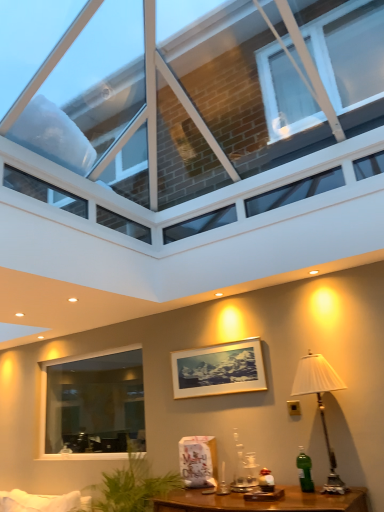
What is the approximate width of white fabric lampshade at right?

14.46 inches.

What do you see at coordinates (320, 404) in the screenshot?
I see `white fabric lampshade at right` at bounding box center [320, 404].

Locate an element on the screen. The width and height of the screenshot is (384, 512). clear glass window at lower left, the 2th window positioned from the top is located at coordinates (92, 405).

Identify the location of white fabric lampshade at right. (320, 404).

Is clear glass window at lower left, the 2th window positioned from the top, inside the boundaries of white fabric lampshade at right, or outside?

clear glass window at lower left, the 2th window positioned from the top, is spatially situated outside white fabric lampshade at right.

Is clear glass window at lower left, the 2th window positioned from the top, far away from white fabric lampshade at right?

clear glass window at lower left, the 2th window positioned from the top, is far away from white fabric lampshade at right.

From a real-world perspective, between clear glass window at lower left, the 2th window positioned from the top, and white fabric lampshade at right, who is vertically higher?

clear glass window at lower left, the 2th window positioned from the top.

Which is behind, clear glass window at lower left, marked as the 1th window in a back-to-front arrangement, or white fabric lampshade at right?

Positioned behind is clear glass window at lower left, marked as the 1th window in a back-to-front arrangement.

Looking at this image, can you confirm if clear glass window at lower left, marked as the 1th window in a back-to-front arrangement, is taller than gold-framed picture at center?

Correct, clear glass window at lower left, marked as the 1th window in a back-to-front arrangement, is much taller as gold-framed picture at center.

From the image's perspective, between clear glass window at lower left, the 2th window positioned from the top, and gold-framed picture at center, who is located below?

clear glass window at lower left, the 2th window positioned from the top, from the image's perspective.

Are clear glass window at lower left, positioned as the second window in front-to-back order, and gold-framed picture at center beside each other?

They are not placed beside each other.

Does point (116, 445) come farther from viewer compared to point (206, 364)?

Yes.

From a real-world perspective, who is located lower, gold-framed picture at center or clear glass window at lower left, the 2th window positioned from the top?

clear glass window at lower left, the 2th window positioned from the top, is physically lower.

Is gold-framed picture at center beside clear glass window at lower left, positioned as the second window in front-to-back order?

There is a gap between gold-framed picture at center and clear glass window at lower left, positioned as the second window in front-to-back order.

Is gold-framed picture at center facing away from clear glass window at lower left, the 2th window positioned from the top?

No, gold-framed picture at center is not facing the opposite direction of clear glass window at lower left, the 2th window positioned from the top.

From the image's perspective, does gold-framed picture at center appear lower than clear glass window at lower left, positioned as the second window in front-to-back order?

No, from the image's perspective, gold-framed picture at center is not beneath clear glass window at lower left, positioned as the second window in front-to-back order.

What's the angular difference between transparent glass roof at upper center, which is the 2th window in bottom-to-top order, and clear glass window at lower left, the 2th window positioned from the top,'s facing directions?

There is a 179-degree angle between the facing directions of transparent glass roof at upper center, which is the 2th window in bottom-to-top order, and clear glass window at lower left, the 2th window positioned from the top.

Based on their positions, is transparent glass roof at upper center, placed as the 2th window when sorted from back to front, located to the left or right of clear glass window at lower left, the 2th window positioned from the top?

Clearly, transparent glass roof at upper center, placed as the 2th window when sorted from back to front, is on the right of clear glass window at lower left, the 2th window positioned from the top, in the image.

Is transparent glass roof at upper center, the 1th window positioned from the front, beside clear glass window at lower left, positioned as the second window in front-to-back order?

There is a gap between transparent glass roof at upper center, the 1th window positioned from the front, and clear glass window at lower left, positioned as the second window in front-to-back order.

From the picture: Does transparent glass roof at upper center, placed as the 2th window when sorted from back to front, turn towards clear glass window at lower left, positioned as the second window in front-to-back order?

No, transparent glass roof at upper center, placed as the 2th window when sorted from back to front, is not aimed at clear glass window at lower left, positioned as the second window in front-to-back order.

Can you tell me how much white fabric lampshade at right and clear glass window at lower left, marked as the 1th window in a back-to-front arrangement, differ in facing direction?

There is a 0.000488-degree angle between the facing directions of white fabric lampshade at right and clear glass window at lower left, marked as the 1th window in a back-to-front arrangement.

From a real-world perspective, which is physically below, white fabric lampshade at right or clear glass window at lower left, the 2th window positioned from the top?

white fabric lampshade at right.

Is white fabric lampshade at right not close to clear glass window at lower left, marked as the 1th window in a back-to-front arrangement?

Yes, white fabric lampshade at right and clear glass window at lower left, marked as the 1th window in a back-to-front arrangement, are located far from each other.

Visually, is white fabric lampshade at right positioned to the left or to the right of clear glass window at lower left, marked as the 1th window in a back-to-front arrangement?

In the image, white fabric lampshade at right appears on the right side of clear glass window at lower left, marked as the 1th window in a back-to-front arrangement.

Does transparent glass roof at upper center, which is the 2th window in bottom-to-top order, have a lesser height compared to gold-framed picture at center?

Incorrect, the height of transparent glass roof at upper center, which is the 2th window in bottom-to-top order, does not fall short of that of gold-framed picture at center.

Does transparent glass roof at upper center, which is the 2th window in bottom-to-top order, have a larger size compared to gold-framed picture at center?

Correct, transparent glass roof at upper center, which is the 2th window in bottom-to-top order, is larger in size than gold-framed picture at center.

Where is `picture frame on the right of transparent glass roof at upper center, which is the 2th window in bottom-to-top order`? picture frame on the right of transparent glass roof at upper center, which is the 2th window in bottom-to-top order is located at coordinates (219, 370).

From a real-world perspective, who is located higher, transparent glass roof at upper center, placed as the 2th window when sorted from back to front, or gold-framed picture at center?

transparent glass roof at upper center, placed as the 2th window when sorted from back to front, is physically above.

Considering the positions of objects transparent glass roof at upper center, the 1th window positioned from the front, and white fabric lampshade at right in the image provided, who is behind, transparent glass roof at upper center, the 1th window positioned from the front, or white fabric lampshade at right?

white fabric lampshade at right is further away from the camera.

Considering the relative sizes of transparent glass roof at upper center, the 1th window positioned from the front, and white fabric lampshade at right in the image provided, is transparent glass roof at upper center, the 1th window positioned from the front, smaller than white fabric lampshade at right?

No, transparent glass roof at upper center, the 1th window positioned from the front, is not smaller than white fabric lampshade at right.

Is transparent glass roof at upper center, the 1th window viewed from the top, facing away from white fabric lampshade at right?

No, transparent glass roof at upper center, the 1th window viewed from the top,'s orientation is not away from white fabric lampshade at right.

Considering the positions of objects transparent glass roof at upper center, which is the 2th window in bottom-to-top order, and white fabric lampshade at right in the image provided, who is more to the left, transparent glass roof at upper center, which is the 2th window in bottom-to-top order, or white fabric lampshade at right?

Positioned to the left is transparent glass roof at upper center, which is the 2th window in bottom-to-top order.

The image size is (384, 512). What are the coordinates of `the 1st window above the white fabric lampshade at right (from a real-world perspective)` in the screenshot? It's located at (92, 405).

Where is `window below the gold-framed picture at center (from the image's perspective)`? The height and width of the screenshot is (512, 384). window below the gold-framed picture at center (from the image's perspective) is located at coordinates (92, 405).

Looking at the image, which one is located closer to transparent glass roof at upper center, which is the 2th window in bottom-to-top order, white fabric lampshade at right or clear glass window at lower left, the 2th window positioned from the top?

The object closer to transparent glass roof at upper center, which is the 2th window in bottom-to-top order, is white fabric lampshade at right.

When comparing their distances from clear glass window at lower left, marked as the 1th window in a back-to-front arrangement, does green glass bottle at lower right or gold-framed picture at center seem closer?

The object closer to clear glass window at lower left, marked as the 1th window in a back-to-front arrangement, is gold-framed picture at center.

In the scene shown: Estimate the real-world distances between objects in this image. Which object is closer to clear glass window at lower left, positioned as the second window in front-to-back order, green glass bottle at lower right or transparent glass roof at upper center, placed as the 2th window when sorted from back to front?

green glass bottle at lower right is closer to clear glass window at lower left, positioned as the second window in front-to-back order.

Based on their spatial positions, is transparent glass roof at upper center, the 1th window positioned from the front, or white fabric lampshade at right further from gold-framed picture at center?

transparent glass roof at upper center, the 1th window positioned from the front, is further to gold-framed picture at center.

Based on their spatial positions, is gold-framed picture at center or green glass bottle at lower right further from transparent glass roof at upper center, which is the 2th window in bottom-to-top order?

green glass bottle at lower right lies further to transparent glass roof at upper center, which is the 2th window in bottom-to-top order, than the other object.

Estimate the real-world distances between objects in this image. Which object is closer to gold-framed picture at center, transparent glass roof at upper center, which is the 2th window in bottom-to-top order, or clear glass window at lower left, which ranks as the 1th window in bottom-to-top order?

transparent glass roof at upper center, which is the 2th window in bottom-to-top order, lies closer to gold-framed picture at center than the other object.

Which object lies further to the anchor point gold-framed picture at center, clear glass window at lower left, the 2th window positioned from the top, or green glass bottle at lower right?

Based on the image, clear glass window at lower left, the 2th window positioned from the top, appears to be further to gold-framed picture at center.

Looking at the image, which one is located closer to gold-framed picture at center, white fabric lampshade at right or clear glass window at lower left, marked as the 1th window in a back-to-front arrangement?

white fabric lampshade at right is closer to gold-framed picture at center.

Find the location of `picture frame between clear glass window at lower left, the 2th window positioned from the top, and white fabric lampshade at right from left to right`. picture frame between clear glass window at lower left, the 2th window positioned from the top, and white fabric lampshade at right from left to right is located at coordinates (219, 370).

Find the location of a particular element. bottle between transparent glass roof at upper center, placed as the 2th window when sorted from back to front, and clear glass window at lower left, marked as the 1th window in a back-to-front arrangement, in the front-back direction is located at coordinates (304, 471).

Find the location of a particular element. Image resolution: width=384 pixels, height=512 pixels. picture frame between clear glass window at lower left, which ranks as the 1th window in bottom-to-top order, and green glass bottle at lower right from left to right is located at coordinates (219, 370).

Find the location of `bottle between white fabric lampshade at right and gold-framed picture at center from front to back`. bottle between white fabric lampshade at right and gold-framed picture at center from front to back is located at coordinates [304, 471].